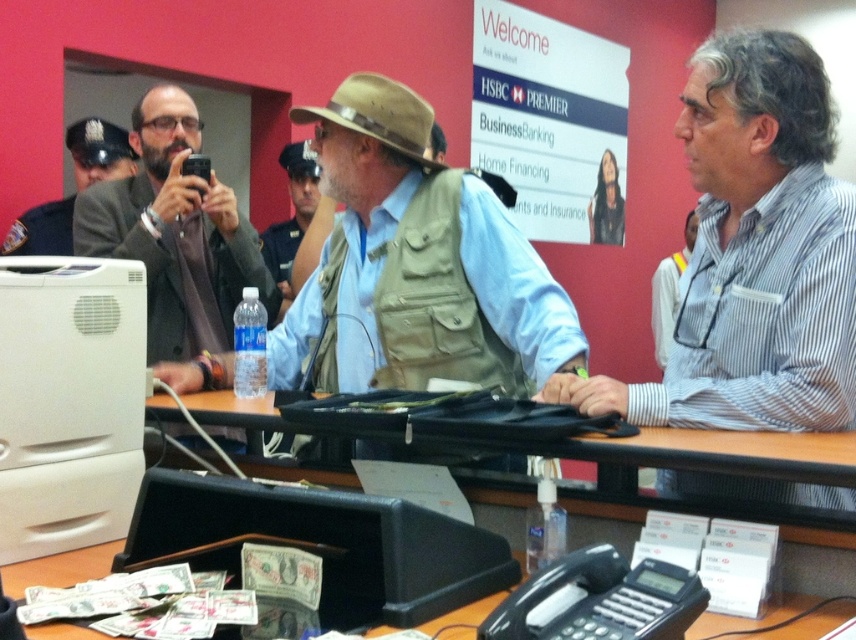
Can you confirm if white striped shirt at center is shorter than tan fabric vest at center?

No, white striped shirt at center is not shorter than tan fabric vest at center.

Can you confirm if white striped shirt at center is smaller than tan fabric vest at center?

Indeed, white striped shirt at center has a smaller size compared to tan fabric vest at center.

Identify the location of white striped shirt at center. This screenshot has width=856, height=640. (756, 253).

Is point (730, 40) closer to camera compared to point (366, 264)?

Yes, it is.

Between point (776, 86) and point (205, 380), which one is positioned in front?

Point (776, 86)

Does point (825, 312) come farther from viewer compared to point (316, 138)?

No, (825, 312) is in front of (316, 138).

This screenshot has width=856, height=640. In order to click on white striped shirt at center in this screenshot , I will do `click(756, 253)`.

Is khaki fabric vest at center above brown leather jacket at center?

No.

Consider the image. Does khaki fabric vest at center appear under brown leather jacket at center?

Yes, khaki fabric vest at center is below brown leather jacket at center.

Which is in front, point (435, 337) or point (244, 241)?

Positioned in front is point (435, 337).

This screenshot has width=856, height=640. What are the coordinates of `khaki fabric vest at center` in the screenshot? It's located at (415, 259).